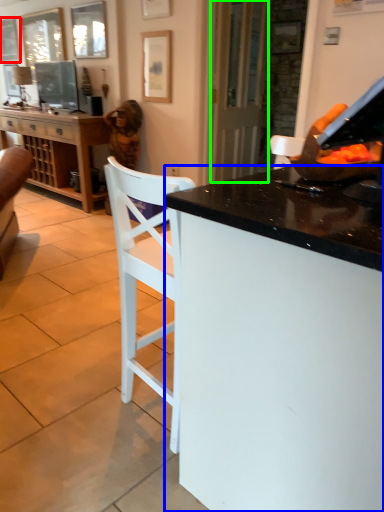
Question: Estimate the real-world distances between objects in this image. Which object is closer to picture frame (highlighted by a red box), desk (highlighted by a blue box) or glass door (highlighted by a green box)?

Choices:
 (A) desk
 (B) glass door

Answer: (B)